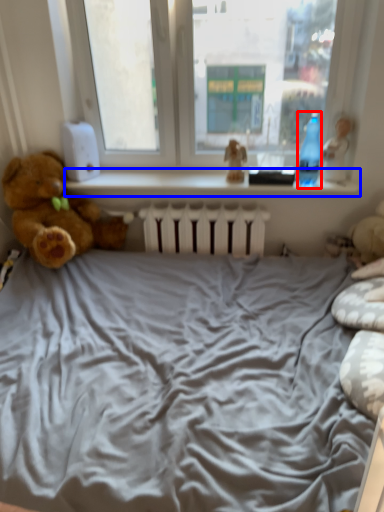
Question: Which of the following is the closest to the observer, bottle (highlighted by a red box) or window sill (highlighted by a blue box)?

Choices:
 (A) bottle
 (B) window sill

Answer: (A)